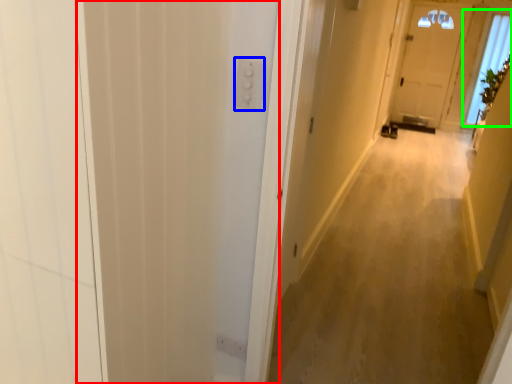
Question: Which is nearer to the screen door (highlighted by a red box)? electric outlet (highlighted by a blue box) or window (highlighted by a green box).

Choices:
 (A) electric outlet
 (B) window

Answer: (A)